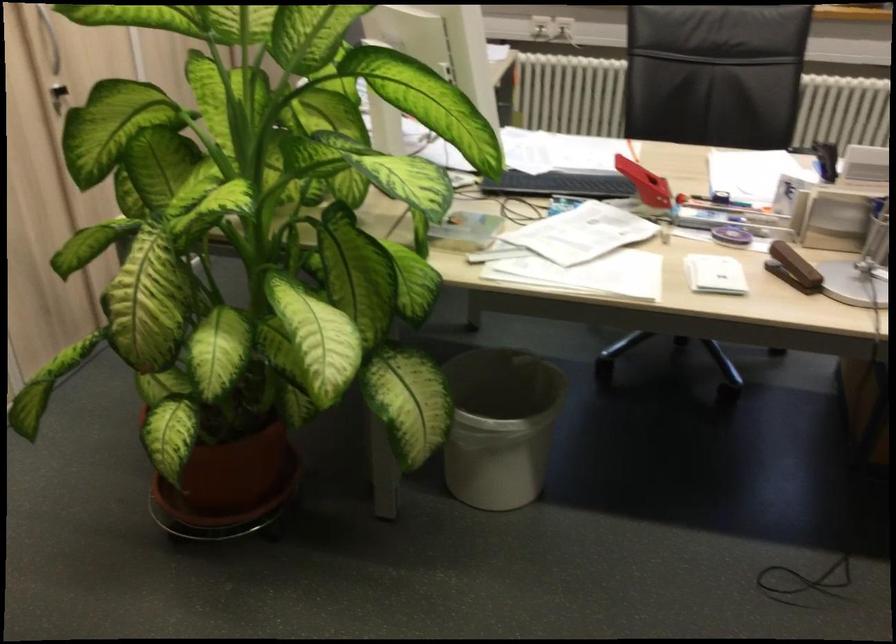
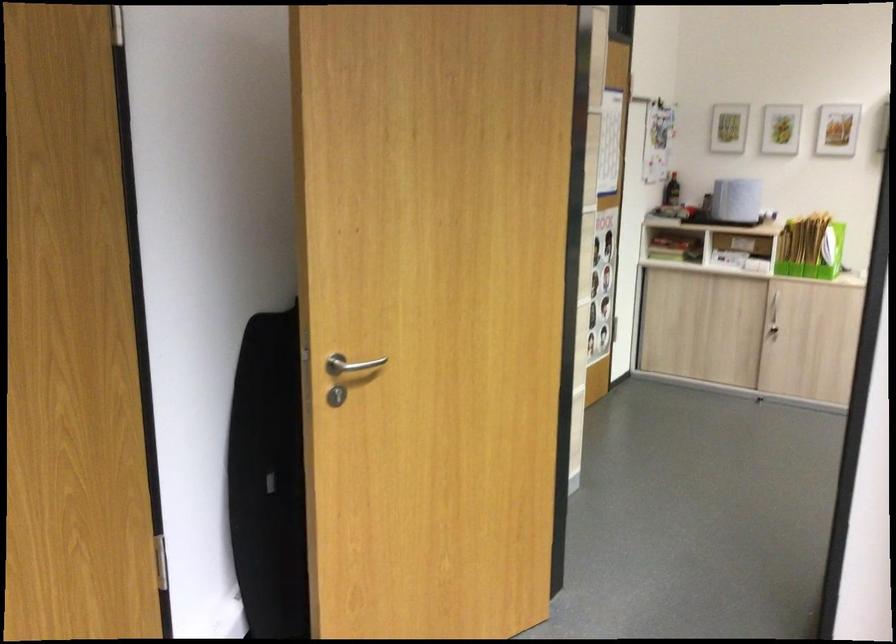
Based on the continuous images, in which direction is the camera rotating?

The rotation direction of the camera is left-down.